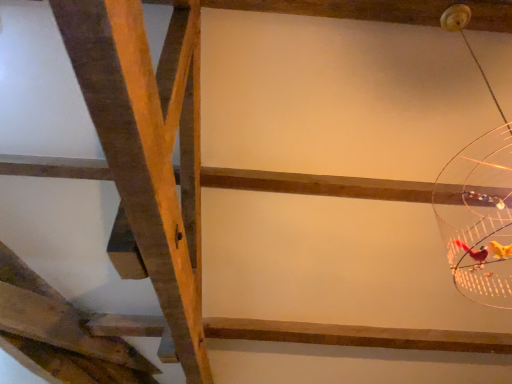
What do you see at coordinates (149, 146) in the screenshot? This screenshot has height=384, width=512. I see `wooden beam at left` at bounding box center [149, 146].

Identify the location of wooden beam at left. The width and height of the screenshot is (512, 384). tap(149, 146).

Locate an element on the screen. wooden beam at left is located at coordinates pos(149,146).